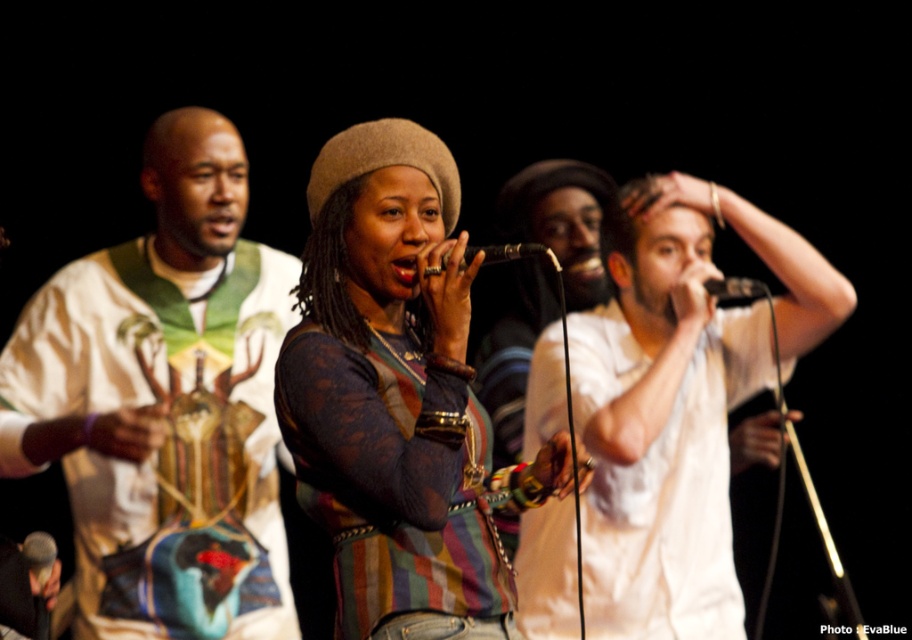
Question: Which point is farther to the camera?

Choices:
 (A) black matte microphone at center
 (B) white satin shirt at left
 (C) white cotton shirt at center
 (D) multicolored lace top at center

Answer: (B)

Question: Which point is farther from the camera taking this photo?

Choices:
 (A) (727, 296)
 (B) (375, 157)
 (C) (265, 570)
 (D) (35, 540)

Answer: (D)

Question: Which object is positioned farthest from the black matte microphone at center?

Choices:
 (A) multicolored lace top at center
 (B) white satin shirt at left
 (C) metallic silver microphone at lower left

Answer: (C)

Question: Where is white satin shirt at left located in relation to white cotton shirt at center in the image?

Choices:
 (A) left
 (B) right

Answer: (A)

Question: Can you confirm if white cotton shirt at center is positioned to the right of black matte microphone at center?

Choices:
 (A) yes
 (B) no

Answer: (A)

Question: Is white cotton shirt at center closer to camera compared to metallic silver microphone at lower left?

Choices:
 (A) no
 (B) yes

Answer: (B)